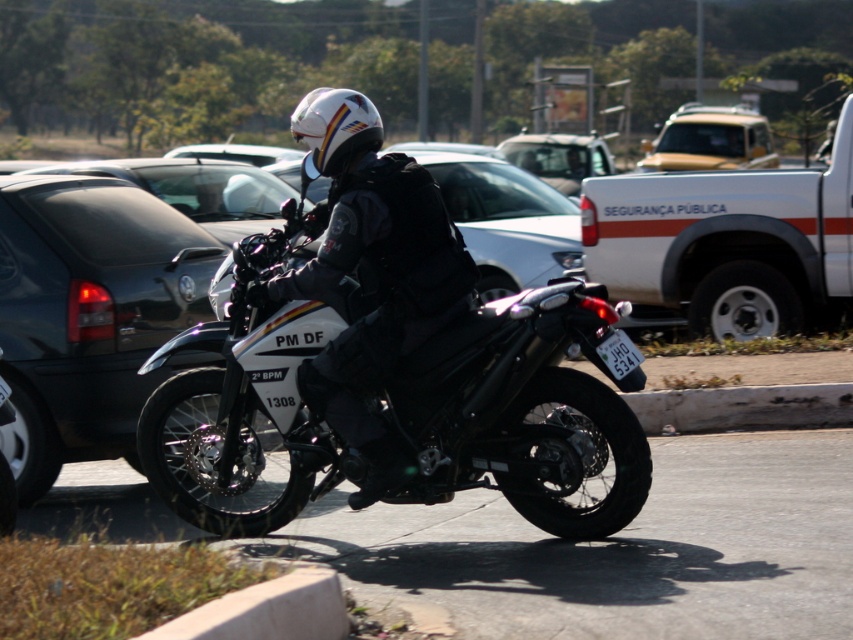
Is black matte helmet at center to the right of white glossy helmet at center from the viewer's perspective?

Indeed, black matte helmet at center is positioned on the right side of white glossy helmet at center.

Does black matte helmet at center have a lesser height compared to white glossy helmet at center?

In fact, black matte helmet at center may be taller than white glossy helmet at center.

Find the location of a particular element. This screenshot has height=640, width=853. black matte helmet at center is located at coordinates (370, 275).

Based on the photo, does black matte helmet at center have a greater height compared to black plastic license plate at center?

Yes, black matte helmet at center is taller than black plastic license plate at center.

Locate an element on the screen. The width and height of the screenshot is (853, 640). black matte helmet at center is located at coordinates (370, 275).

Between point (306, 112) and point (643, 356), which one is positioned behind?

Point (643, 356)

Locate an element on the screen. This screenshot has width=853, height=640. black matte helmet at center is located at coordinates (370, 275).

Who is more distant from viewer, (x=549, y=385) or (x=711, y=234)?

The point (x=711, y=234) is more distant.

Is metallic black motorcycle at center below white matte ambulance at center?

Yes, metallic black motorcycle at center is below white matte ambulance at center.

The height and width of the screenshot is (640, 853). Identify the location of metallic black motorcycle at center. (524, 412).